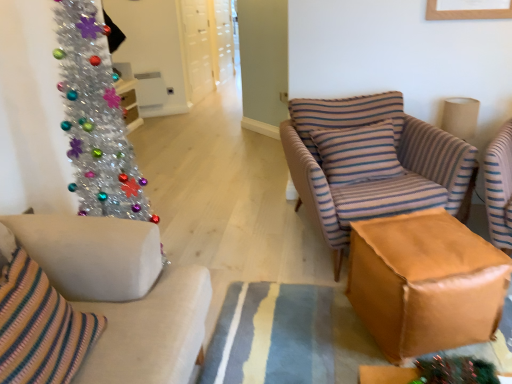
Question: From a real-world perspective, is shiny metallic christmas tree at left physically below brown leather ottoman at center?

Choices:
 (A) no
 (B) yes

Answer: (A)

Question: From the image's perspective, is shiny metallic christmas tree at left under brown leather ottoman at center?

Choices:
 (A) no
 (B) yes

Answer: (A)

Question: Does shiny metallic christmas tree at left have a lesser height compared to brown leather ottoman at center?

Choices:
 (A) no
 (B) yes

Answer: (A)

Question: Is shiny metallic christmas tree at left facing away from brown leather ottoman at center?

Choices:
 (A) no
 (B) yes

Answer: (A)

Question: Would you say shiny metallic christmas tree at left contains brown leather ottoman at center?

Choices:
 (A) no
 (B) yes

Answer: (A)

Question: In terms of width, does striped fabric armchair at center look wider or thinner when compared to shiny metallic christmas tree at left?

Choices:
 (A) wide
 (B) thin

Answer: (A)

Question: Choose the correct answer: Is striped fabric armchair at center inside shiny metallic christmas tree at left or outside it?

Choices:
 (A) inside
 (B) outside

Answer: (B)

Question: Looking at the image, does striped fabric armchair at center seem bigger or smaller compared to shiny metallic christmas tree at left?

Choices:
 (A) small
 (B) big

Answer: (B)

Question: Does point (340, 201) appear closer or farther from the camera than point (101, 107)?

Choices:
 (A) closer
 (B) farther

Answer: (B)

Question: From a real-world perspective, is brown leather ottoman at center positioned above or below striped fabric armchair at center?

Choices:
 (A) below
 (B) above

Answer: (A)

Question: Is brown leather ottoman at center bigger or smaller than striped fabric armchair at center?

Choices:
 (A) small
 (B) big

Answer: (A)

Question: From the image's perspective, is brown leather ottoman at center above or below striped fabric armchair at center?

Choices:
 (A) below
 (B) above

Answer: (A)

Question: Considering the positions of brown leather ottoman at center and striped fabric armchair at center in the image, is brown leather ottoman at center wider or thinner than striped fabric armchair at center?

Choices:
 (A) wide
 (B) thin

Answer: (B)

Question: Considering the positions of point (153, 225) and point (108, 180), is point (153, 225) closer or farther from the camera than point (108, 180)?

Choices:
 (A) closer
 (B) farther

Answer: (A)

Question: From the image's perspective, is white fabric couch at left above or below shiny metallic christmas tree at left?

Choices:
 (A) below
 (B) above

Answer: (A)